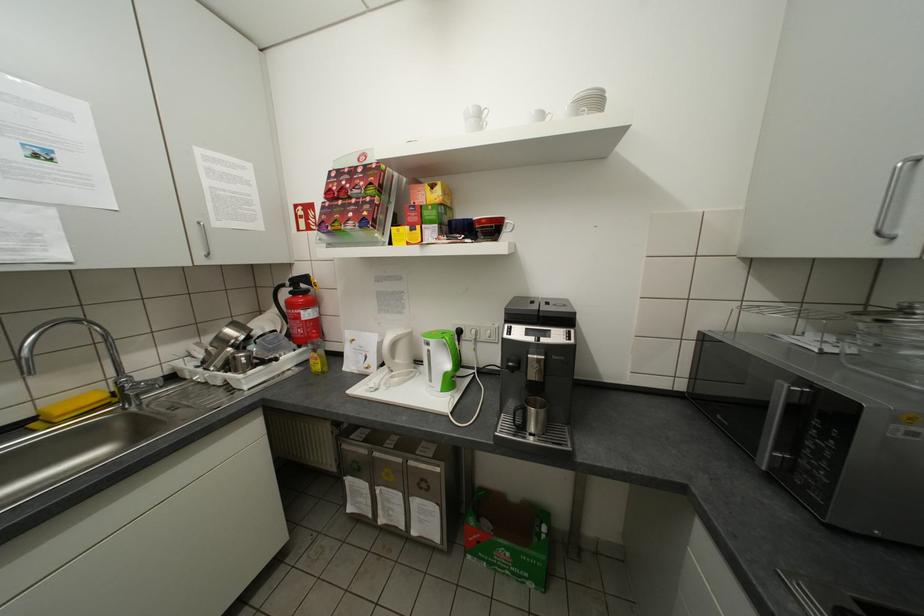
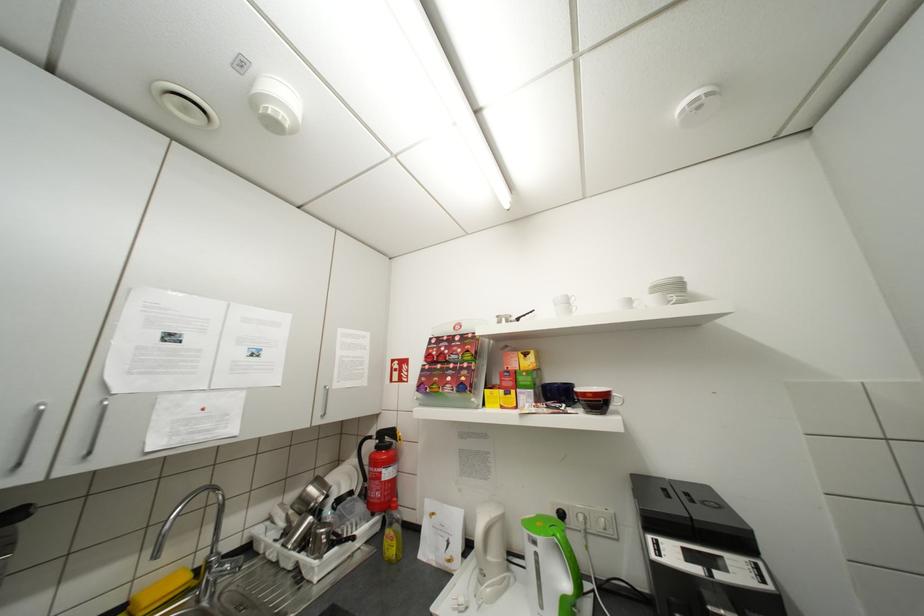
Question: Based on the continuous images, in which direction is the camera rotating? Reply with the corresponding letter.

Choices:
 (A) Left
 (B) Right
 (C) Up
 (D) Down

Answer: (C)